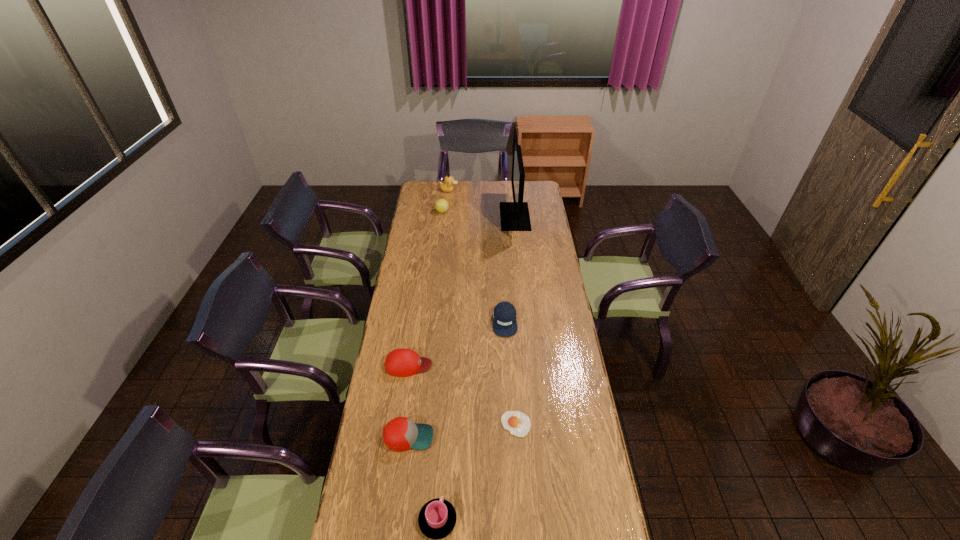
What are the coordinates of `empty space that is in between the rightmost baseball cap and the second tallest object` in the screenshot? It's located at (477, 256).

Where is `blank region between the second farthest baseball cap and the shortest object`? blank region between the second farthest baseball cap and the shortest object is located at coordinates (463, 395).

Find the location of a particular element. free space between the shortest object and the duckling is located at coordinates (483, 307).

Locate an element on the screen. Image resolution: width=960 pixels, height=540 pixels. vacant area between the nearest baseball cap and the tennis ball is located at coordinates (425, 325).

Locate an element on the screen. This screenshot has width=960, height=540. free space between the duckling and the monitor is located at coordinates (482, 204).

The width and height of the screenshot is (960, 540). What are the coordinates of `free space between the rightmost baseball cap and the tennis ball` in the screenshot? It's located at (473, 267).

This screenshot has height=540, width=960. In order to click on free spot between the rightmost baseball cap and the egg yolk in this screenshot , I will do `click(511, 373)`.

Select which object appears as the fourth closest to the tallest object. Please provide its 2D coordinates. Your answer should be formatted as a tuple, i.e. [(x, y)], where the tuple contains the x and y coordinates of a point satisfying the conditions above.

[(402, 362)]

Locate an element on the screen. object that can be found as the second closest to the farthest object is located at coordinates click(x=514, y=216).

The height and width of the screenshot is (540, 960). What are the coordinates of `baseball cap that stands as the closest to the fourth farthest object` in the screenshot? It's located at (402, 362).